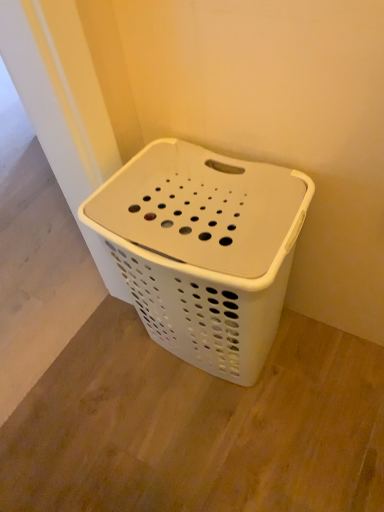
What is the approximate height of white plastic laundry basket at center?

white plastic laundry basket at center is 22.87 inches tall.

Describe the element at coordinates (203, 250) in the screenshot. I see `white plastic laundry basket at center` at that location.

At what (x,y) coordinates should I click in order to perform the action: click on white plastic laundry basket at center. Please return your answer as a coordinate pair (x, y). The height and width of the screenshot is (512, 384). Looking at the image, I should click on (203, 250).

Locate an element on the screen. white plastic laundry basket at center is located at coordinates (203, 250).